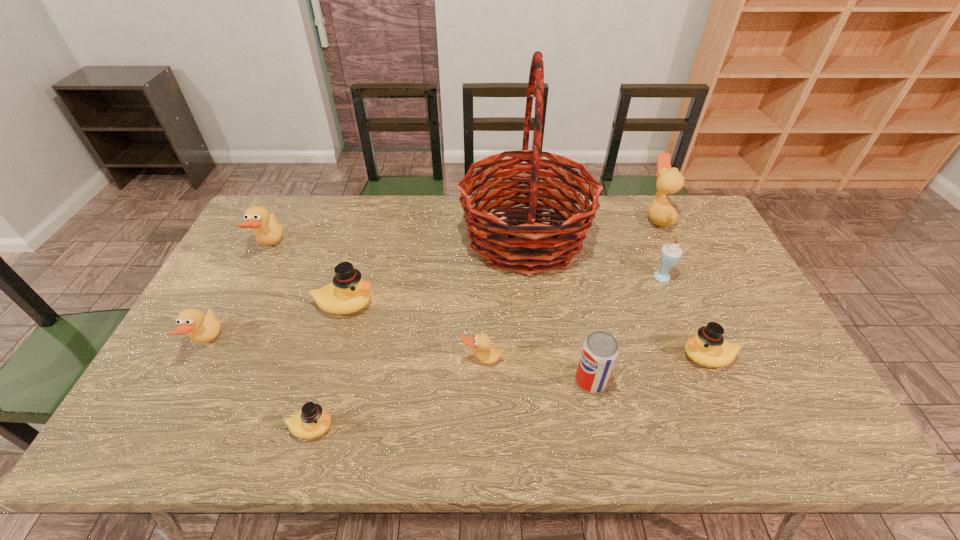
The width and height of the screenshot is (960, 540). I want to click on free space located 0.270m on the straw side of the milkshake, so click(x=564, y=279).

Find the location of a particular element. free space located on the straw side of the milkshake is located at coordinates (522, 279).

The image size is (960, 540). What are the coordinates of `free region located on the beak of the second biggest tan duck` in the screenshot? It's located at (379, 246).

The image size is (960, 540). Identify the location of free spot located on the right of the soda. (708, 381).

This screenshot has height=540, width=960. In order to click on free space located 0.250m on the front-facing side of the fifth nearest duck in this screenshot , I will do `click(463, 305)`.

The image size is (960, 540). Identify the location of free spot located 0.130m on the beak of the third biggest tan duck. (268, 342).

The image size is (960, 540). In order to click on free point located on the front-facing side of the second biggest yellow duck in this screenshot , I will do `click(572, 356)`.

Locate an element on the screen. vacant point located 0.320m on the front-facing side of the second biggest yellow duck is located at coordinates (557, 356).

Find the location of `blank space located 0.140m on the front-facing side of the second biggest yellow duck`. blank space located 0.140m on the front-facing side of the second biggest yellow duck is located at coordinates (626, 356).

Identify the location of free point located on the beak of the third tan duck from left to right. This screenshot has height=540, width=960. (483, 407).